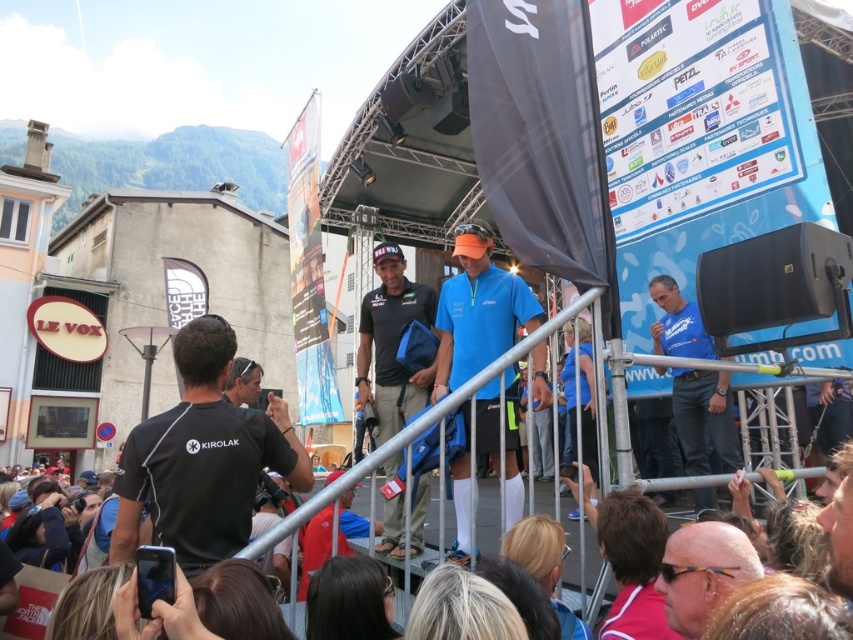
You are a photographer at the event and want to capture a photo that includes both the blue fabric shirt at center and the matte black sunglasses at lower right. Based on their positions, which object should you focus on first to ensure both are in the frame?

The blue fabric shirt at center is located above matte black sunglasses at lower right, so you should focus on the blue fabric shirt at center first to ensure both are in the frame.

You are a photographer positioned at the camera location. You want to capture a closeup shot of the blue fabric shirt at center. Given that your camera can focus on objects within 30 meters, will you be able to achieve a clear closeup?

The blue fabric shirt at center is 31.64 meters away from the camera, which is beyond the camera focus range of 30 meters. Therefore, the camera cannot focus on the blue fabric shirt at center to achieve a clear closeup.

You are an event organizer at the stage. You need to place a decorative banner that requires a tall object to hang it. Which object between the black fabric bag at center and the matte black sunglasses at lower right would be suitable for hanging the banner?

The black fabric bag at center is much taller than the matte black sunglasses at lower right, so it would be suitable for hanging the banner.